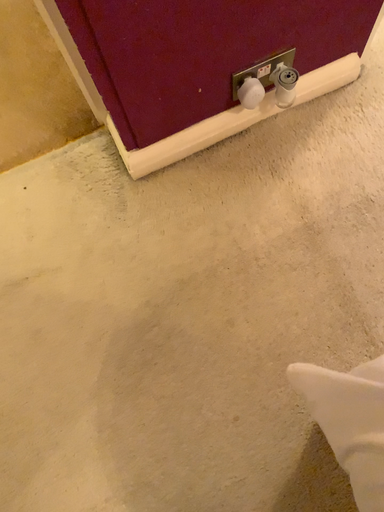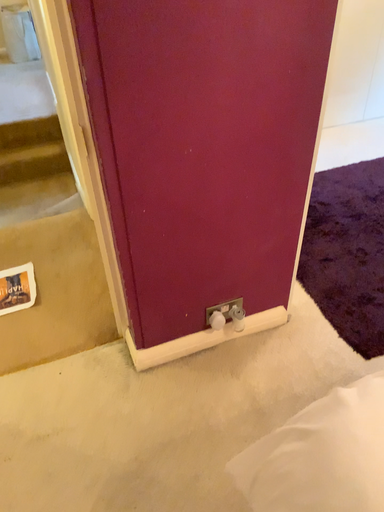
Question: Which way did the camera rotate in the video?

Choices:
 (A) rotated downward
 (B) rotated upward

Answer: (B)